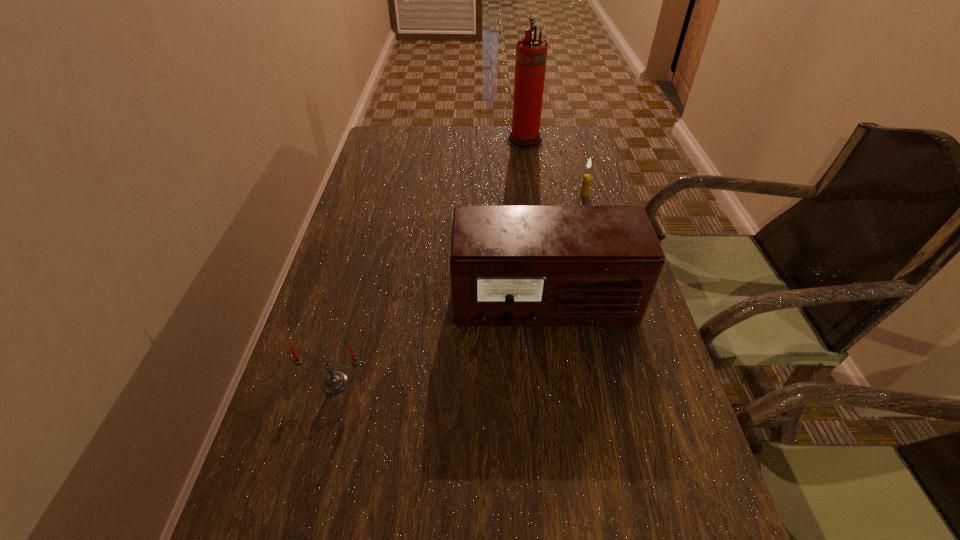
This screenshot has height=540, width=960. I want to click on the tallest object, so click(x=531, y=53).

Locate an element on the screen. The height and width of the screenshot is (540, 960). fire extinguisher is located at coordinates (531, 53).

What are the coordinates of `the second nearest object` in the screenshot? It's located at (510, 265).

At what (x,y) coordinates should I click in order to perform the action: click on the second tallest object. Please return your answer as a coordinate pair (x, y). The image size is (960, 540). Looking at the image, I should click on (510, 265).

You are a GUI agent. You are given a task and a screenshot of the screen. Output one action in this format:
    pyautogui.click(x=<x>, y=<y>)
    Task: Click on the third nearest object
    The image size is (960, 540).
    Given the screenshot: What is the action you would take?
    pyautogui.click(x=586, y=181)

What are the coordinates of `the farther candle` in the screenshot? It's located at (586, 181).

Find the location of a particular element. This screenshot has height=540, width=960. the leftmost object is located at coordinates (334, 382).

The height and width of the screenshot is (540, 960). Find the location of `the left candle`. the left candle is located at coordinates (334, 382).

The height and width of the screenshot is (540, 960). I want to click on free space located 0.270m at the discharge end of the farthest object, so click(x=429, y=141).

Locate an element on the screen. The height and width of the screenshot is (540, 960). vacant region located 0.100m at the discharge end of the farthest object is located at coordinates (478, 141).